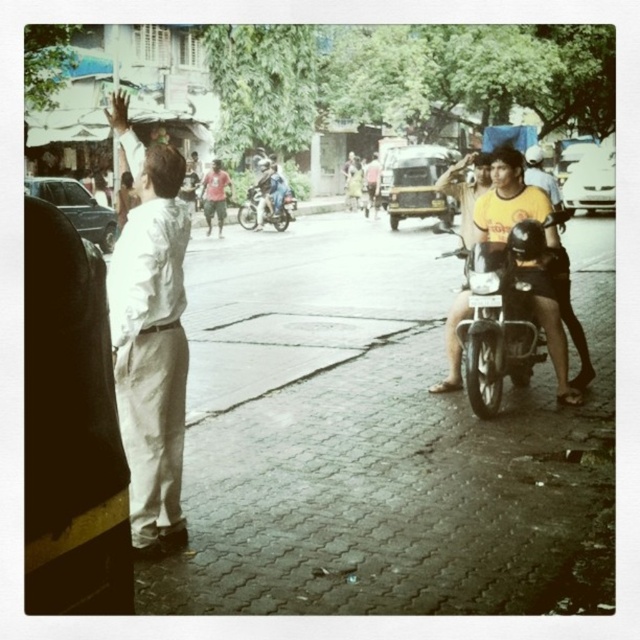
You are a delivery driver who needs to park your motorcycle in a specific spot. The motorcycle is at point (x=502, y=314). If you want to park it at point 0.5, 0.5, which direction should you move the motorcycle?

The black matte motorcycle at center right is at point (x=502, y=314). To move it to 0.5, 0.5, you should move it slightly to the left and downward.